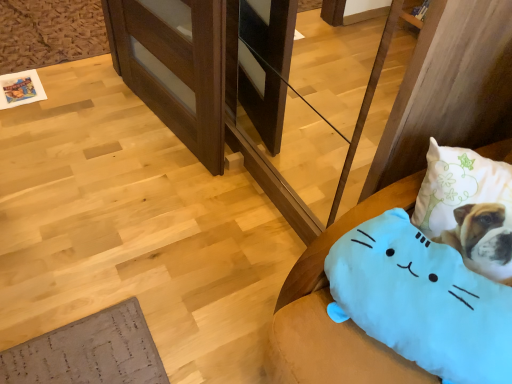
I want to click on vacant space that is to the left of wooden at left, so click(80, 129).